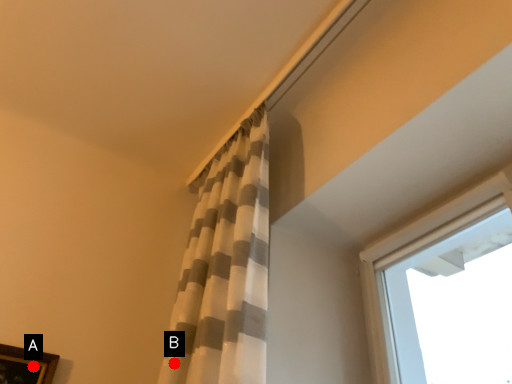
Question: Two points are circled on the image, labeled by A and B beside each circle. Which point is farther from the camera taking this photo?

Choices:
 (A) A is further
 (B) B is further

Answer: (A)